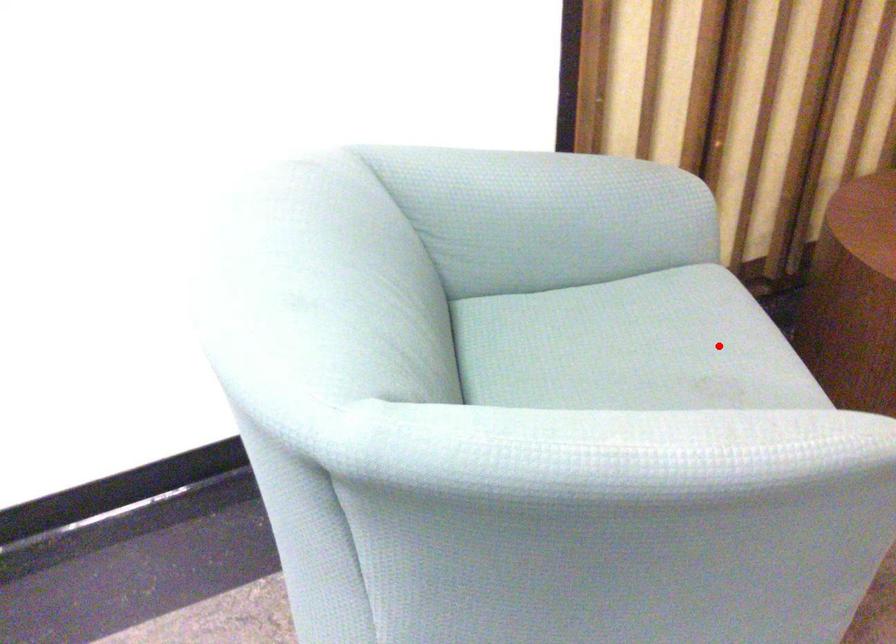
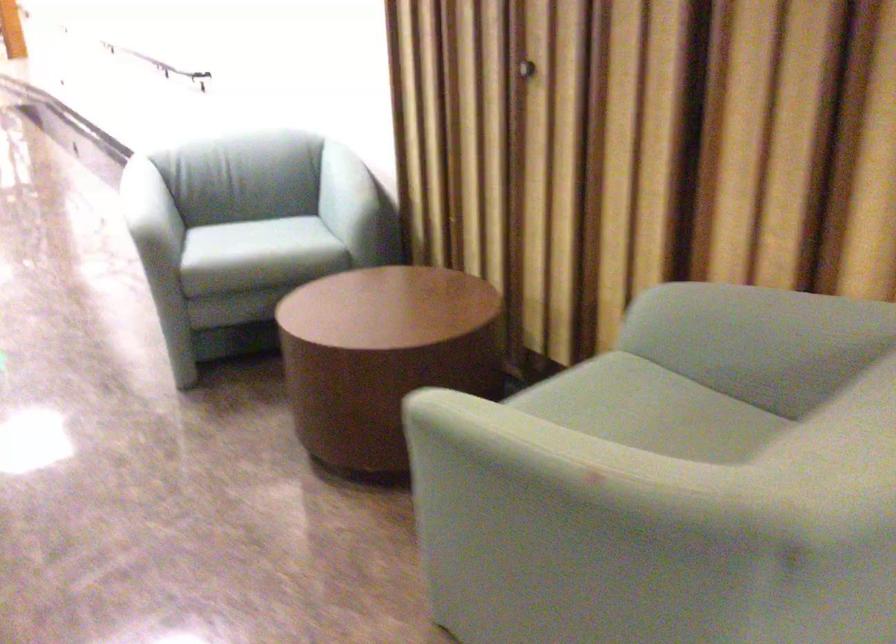
The point at the highlighted location is marked in the first image. Where is the corresponding point in the second image?

(265, 243)